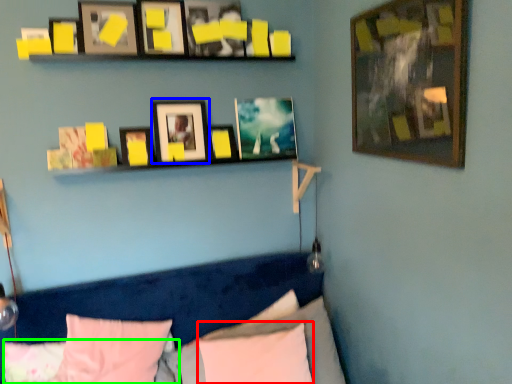
Question: Which object is the farthest from pillow (highlighted by a red box)? Choose among these: picture frame (highlighted by a blue box) or pillow (highlighted by a green box).

Choices:
 (A) picture frame
 (B) pillow

Answer: (A)